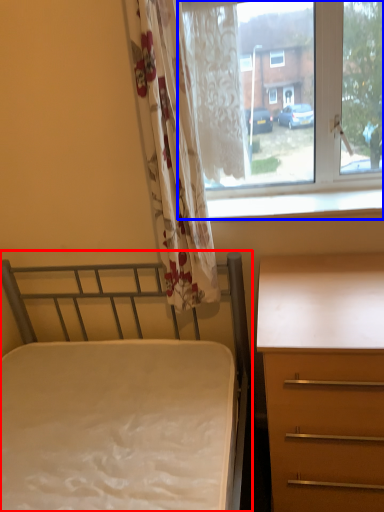
Question: Which of the following is the closest to the observer, bed (highlighted by a red box) or window (highlighted by a blue box)?

Choices:
 (A) bed
 (B) window

Answer: (A)